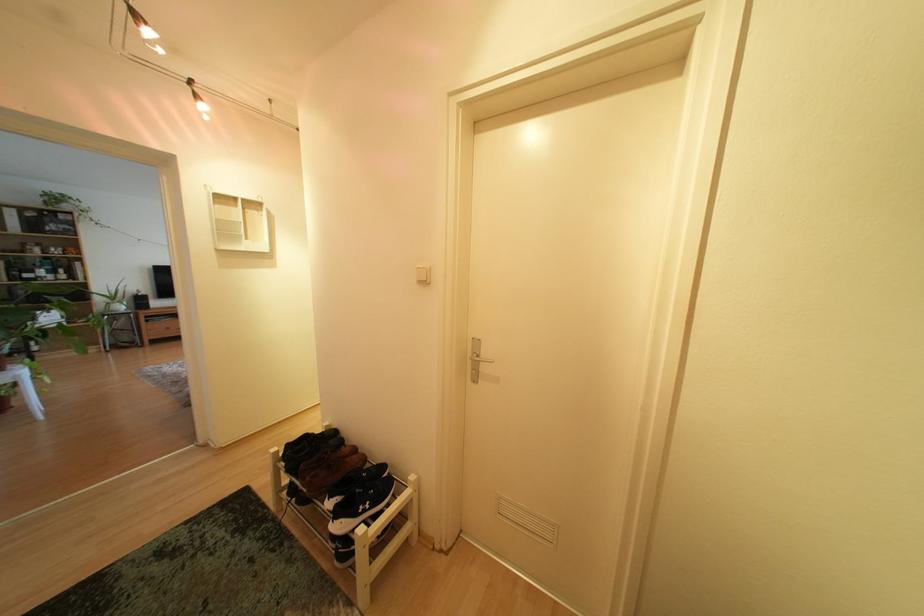
Identify the location of silver door handle. (476, 359).